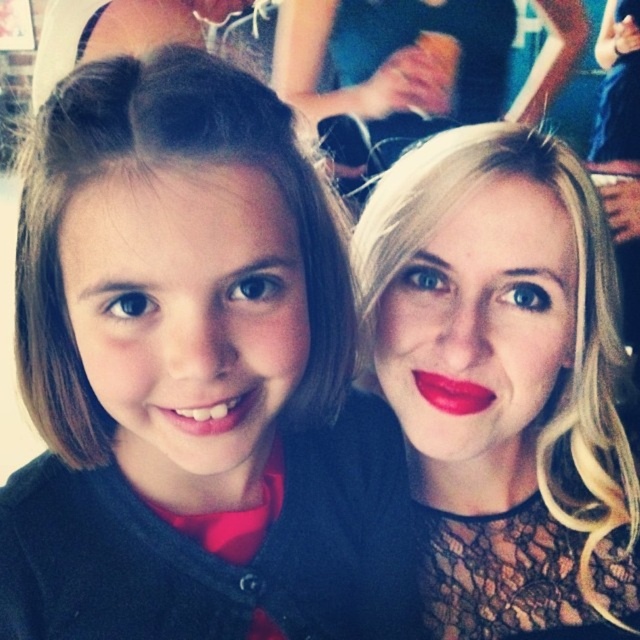
Question: Considering the real-world distances, which object is farthest from the brown hair at left?

Choices:
 (A) blonde hair at right
 (B) matte red lipstick at center

Answer: (B)

Question: Does blonde hair at right appear over matte red lipstick at center?

Choices:
 (A) no
 (B) yes

Answer: (A)

Question: Which object is closer to the camera taking this photo?

Choices:
 (A) matte red lipstick at center
 (B) matte red lipstick at lower center

Answer: (B)

Question: Can you confirm if blonde hair at right is positioned to the right of matte red lipstick at lower center?

Choices:
 (A) no
 (B) yes

Answer: (B)

Question: Among these objects, which one is farthest from the camera?

Choices:
 (A) matte red lipstick at center
 (B) blonde hair at right
 (C) matte red lipstick at lower center

Answer: (A)

Question: Is brown hair at left further to the viewer compared to matte red lipstick at lower center?

Choices:
 (A) yes
 (B) no

Answer: (B)